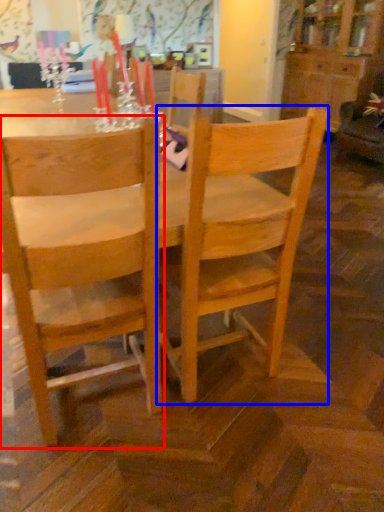
Question: Which point is closer to the camera, chair (highlighted by a red box) or chair (highlighted by a blue box)?

Choices:
 (A) chair
 (B) chair

Answer: (A)